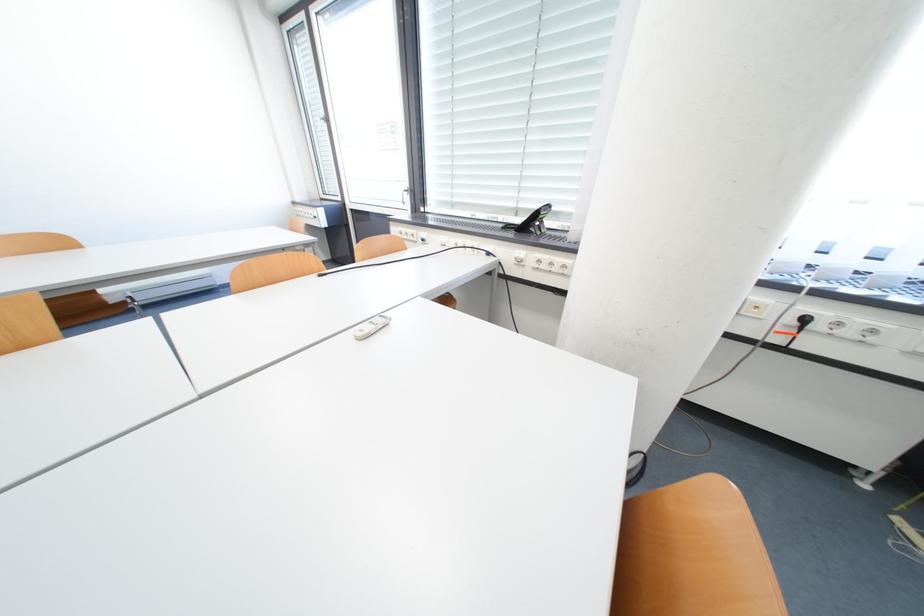
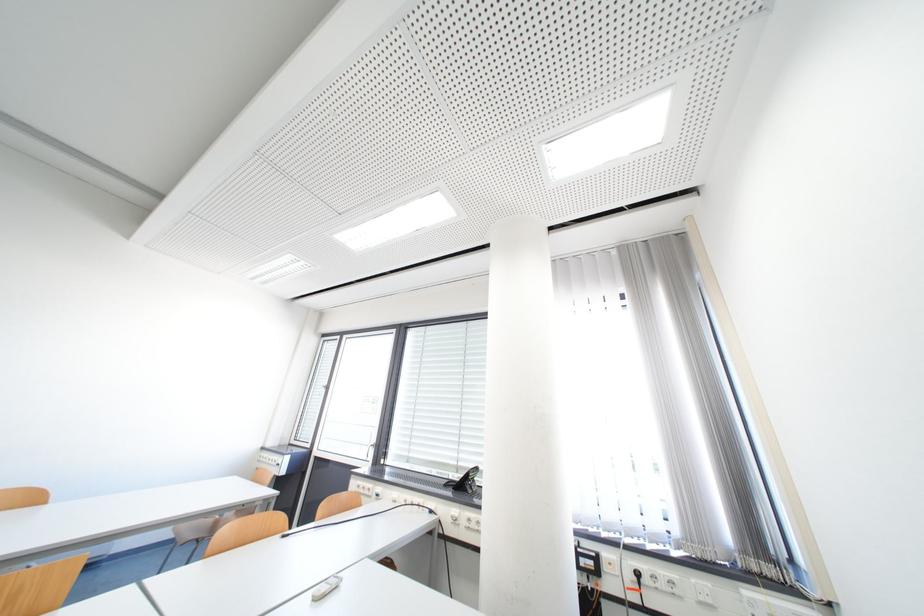
Find the pixel in the second image that matches (x=417, y=217) in the first image.

(377, 469)